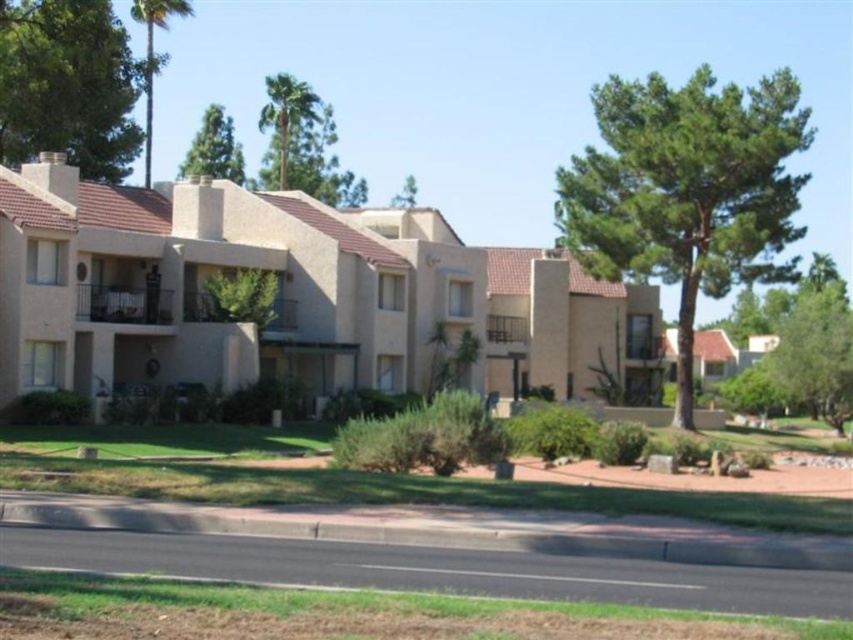
Question: Is green leafy palm at upper center smaller than green leafy tree at center?

Choices:
 (A) yes
 (B) no

Answer: (B)

Question: Which point is closer to the camera taking this photo?

Choices:
 (A) pyautogui.click(x=70, y=44)
 (B) pyautogui.click(x=708, y=179)

Answer: (A)

Question: Is green leafy tree at upper left to the left of green leafy tree at center from the viewer's perspective?

Choices:
 (A) yes
 (B) no

Answer: (A)

Question: Estimate the real-world distances between objects in this image. Which object is closer to the green leafy tree at center?

Choices:
 (A) green leafy palm tree at upper left
 (B) green leafy tree at upper right

Answer: (A)

Question: Does green leafy tree at upper left have a larger size compared to green leafy palm tree at upper left?

Choices:
 (A) yes
 (B) no

Answer: (B)

Question: Which point is closer to the camera?

Choices:
 (A) (62, 97)
 (B) (155, 13)
 (C) (396, 196)
 (D) (218, 161)

Answer: (A)